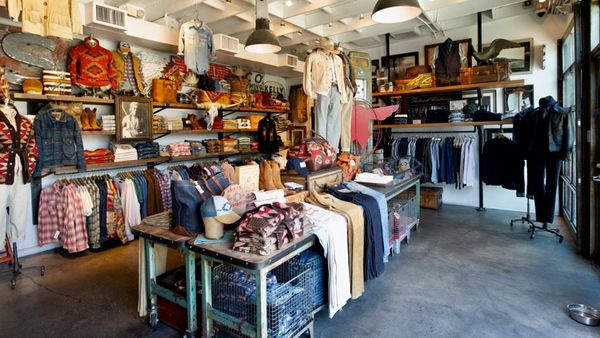
Locate an element on the screen. lamp is located at coordinates (398, 35).